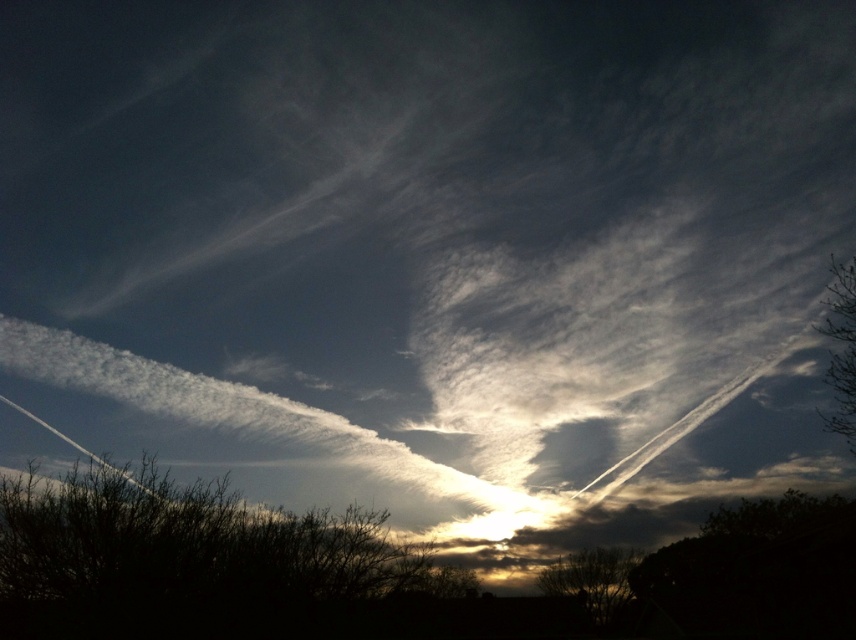
Is silhouette bare tree at lower center to the right of green leafy tree at upper right from the viewer's perspective?

In fact, silhouette bare tree at lower center is to the left of green leafy tree at upper right.

Can you confirm if silhouette bare tree at lower center is thinner than green leafy tree at upper right?

Correct, silhouette bare tree at lower center's width is less than green leafy tree at upper right's.

Does point (569, 568) lie behind point (846, 371)?

Yes, it is behind point (846, 371).

Locate an element on the screen. The height and width of the screenshot is (640, 856). silhouette bare tree at lower center is located at coordinates (592, 579).

Can you confirm if silhouette leafless tree at lower center is positioned below green leafy tree at upper right?

Correct, silhouette leafless tree at lower center is located below green leafy tree at upper right.

Does silhouette leafless tree at lower center have a greater width compared to green leafy tree at upper right?

Indeed, silhouette leafless tree at lower center has a greater width compared to green leafy tree at upper right.

Is point (19, 484) more distant than point (849, 291)?

No, it is in front of (849, 291).

Find the location of `silhouette leafless tree at lower center`. silhouette leafless tree at lower center is located at coordinates (182, 560).

Is silhouette leafless tree at lower center shorter than silhouette bare tree at lower center?

Incorrect, silhouette leafless tree at lower center's height does not fall short of silhouette bare tree at lower center's.

Is silhouette leafless tree at lower center bigger than silhouette bare tree at lower center?

Indeed, silhouette leafless tree at lower center has a larger size compared to silhouette bare tree at lower center.

Which is in front, point (277, 600) or point (597, 605)?

Point (277, 600)

You are a GUI agent. You are given a task and a screenshot of the screen. Output one action in this format:
    pyautogui.click(x=<x>, y=<y>)
    Task: Click on the silhouette leafless tree at lower center
    
    Given the screenshot: What is the action you would take?
    coord(182,560)